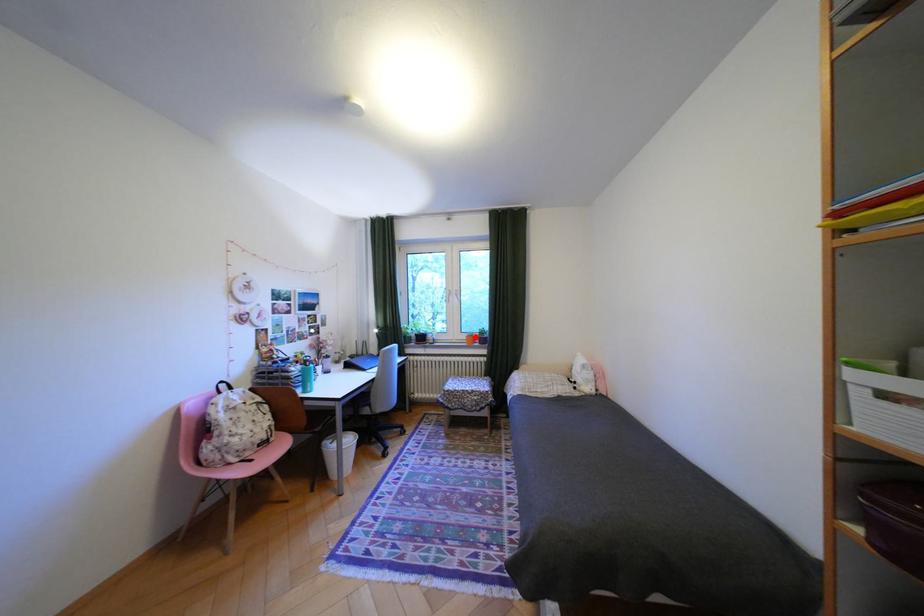
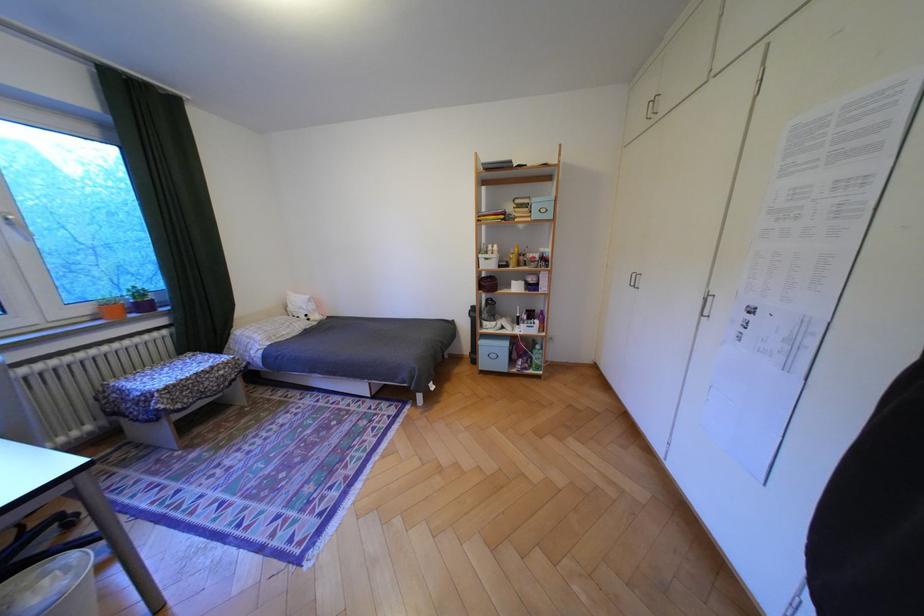
Question: I am providing you with two images of the same scene from different viewpoints. A red point is marked on the first image. At the location where the point appears in image 1, is it still visible in image 2?

Choices:
 (A) Yes
 (B) No

Answer: (A)